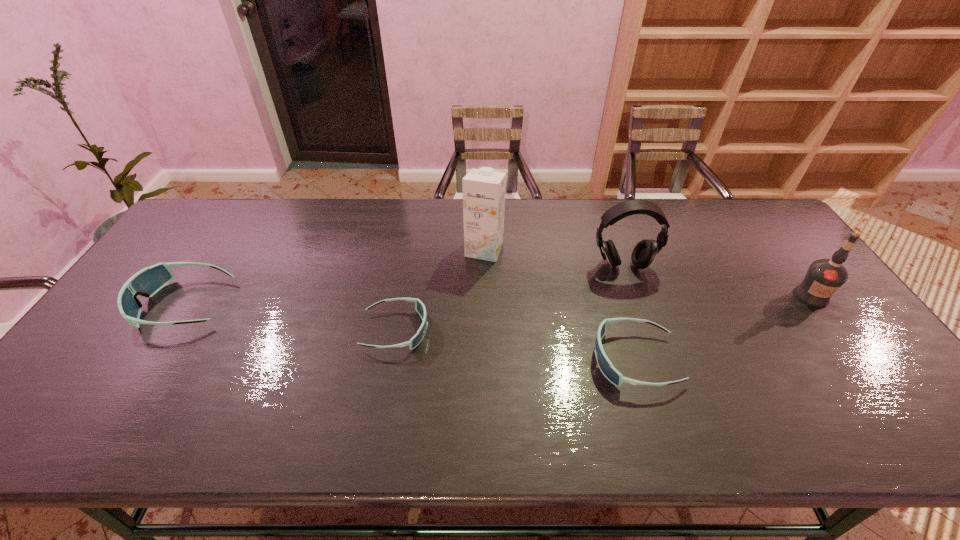
Please point a spot to add another goggles on the right. Please provide its 2D coordinates. Your answer should be formatted as a tuple, i.e. [(x, y)], where the tuple contains the x and y coordinates of a point satisfying the conditions above.

[(905, 394)]